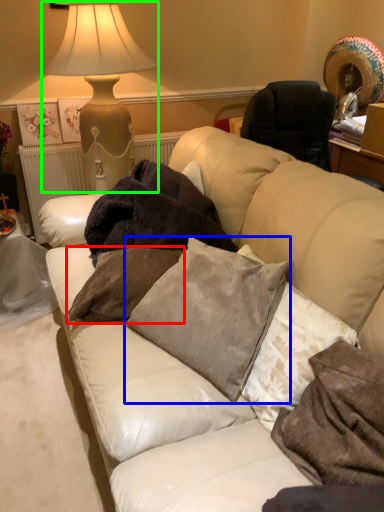
Question: Which is farther away from pillow (highlighted by a red box)? pillow (highlighted by a blue box) or table lamp (highlighted by a green box)?

Choices:
 (A) pillow
 (B) table lamp

Answer: (B)